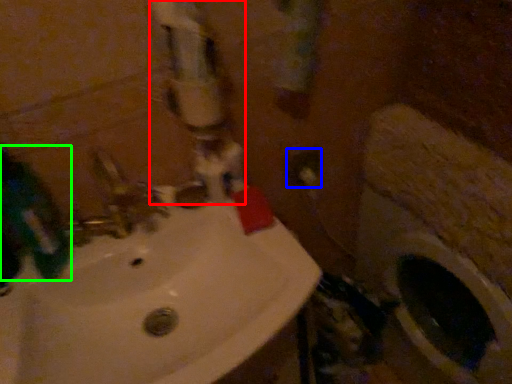
Question: Which object is the closest to the water pipe (highlighted by a red box)? Choose among these: electric outlet (highlighted by a blue box) or mouthwash (highlighted by a green box).

Choices:
 (A) electric outlet
 (B) mouthwash

Answer: (B)